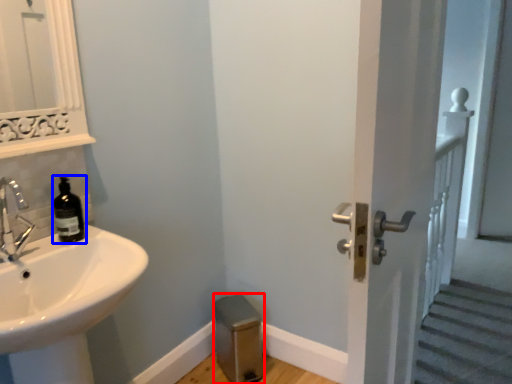
Question: Which of the following is the closest to the observer, step stool (highlighted by a red box) or bottle (highlighted by a blue box)?

Choices:
 (A) step stool
 (B) bottle

Answer: (B)